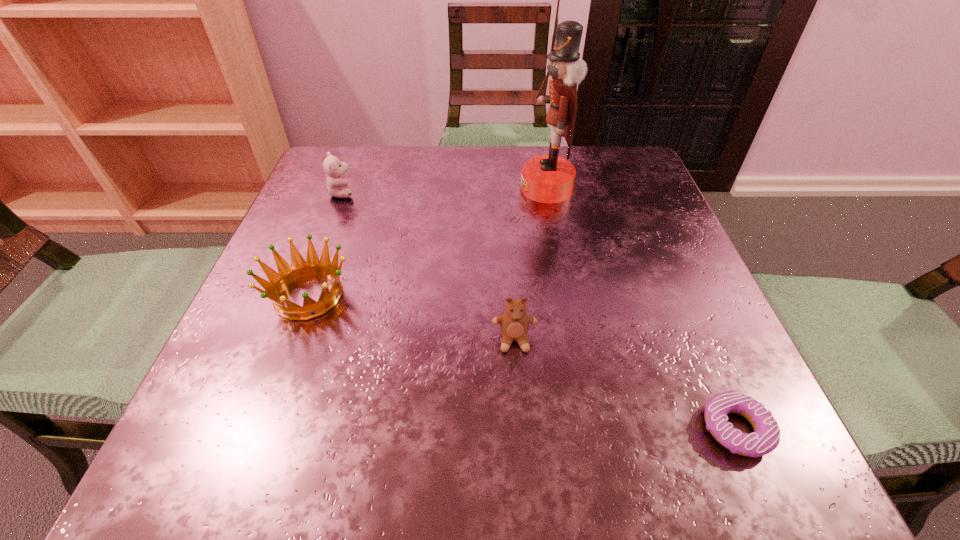
Identify the location of vacant space located 0.140m on the front-facing side of the second object from right to left. (456, 188).

This screenshot has height=540, width=960. I want to click on blank area located 0.180m at the face of the farther teddy bear, so click(439, 193).

At what (x,y) coordinates should I click in order to perform the action: click on vacant space situated 0.160m on the front-facing side of the third object from right to left. Please return your answer as a coordinate pair (x, y). Image resolution: width=960 pixels, height=540 pixels. Looking at the image, I should click on (x=522, y=464).

Image resolution: width=960 pixels, height=540 pixels. In order to click on free location located 0.060m on the right of the crown in this screenshot , I will do `click(389, 295)`.

Find the location of a particular element. This screenshot has height=540, width=960. free region located on the back of the shortest object is located at coordinates click(660, 254).

Identify the location of nutcracker at the far edge. The width and height of the screenshot is (960, 540). (550, 178).

Where is `teddy bear that is at the far edge`? Image resolution: width=960 pixels, height=540 pixels. teddy bear that is at the far edge is located at coordinates (335, 170).

At what (x,y) coordinates should I click in order to perform the action: click on object situated at the near edge. Please return your answer as a coordinate pair (x, y). The image size is (960, 540). Looking at the image, I should click on (766, 436).

The width and height of the screenshot is (960, 540). What are the coordinates of `teddy bear that is at the left edge` in the screenshot? It's located at (335, 170).

Locate an element on the screen. The width and height of the screenshot is (960, 540). crown that is at the left edge is located at coordinates (287, 274).